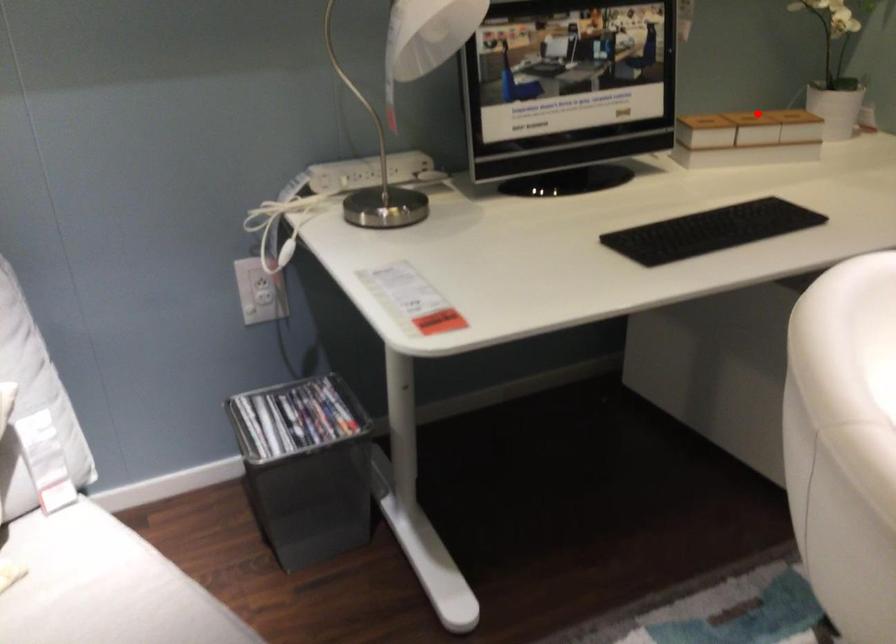
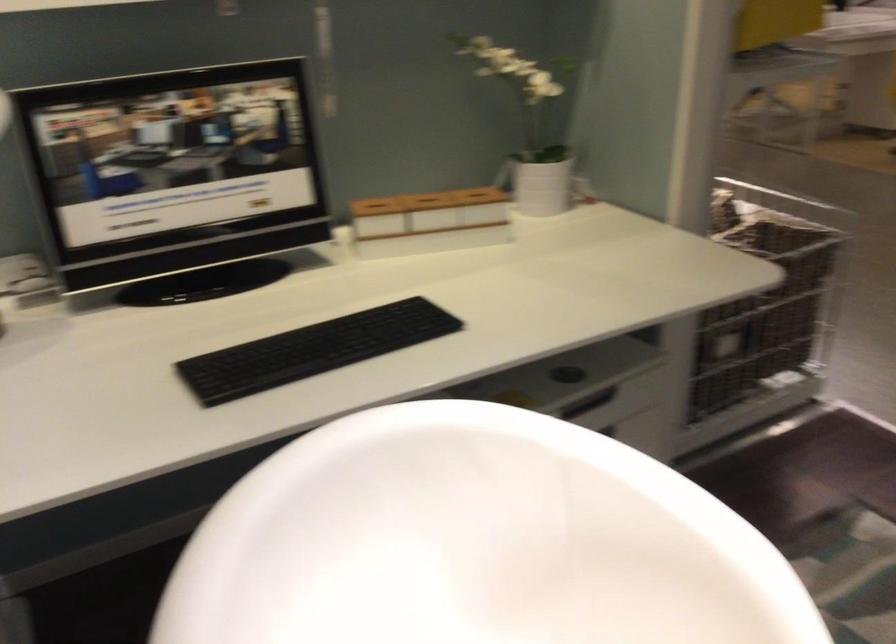
Question: I am providing you with two images of the same scene from different viewpoints. Image1 has a red point marked. In image2, the corresponding 3D location appears at what relative position? Reply with the corresponding letter.

Choices:
 (A) Closer
 (B) Farther

Answer: (A)